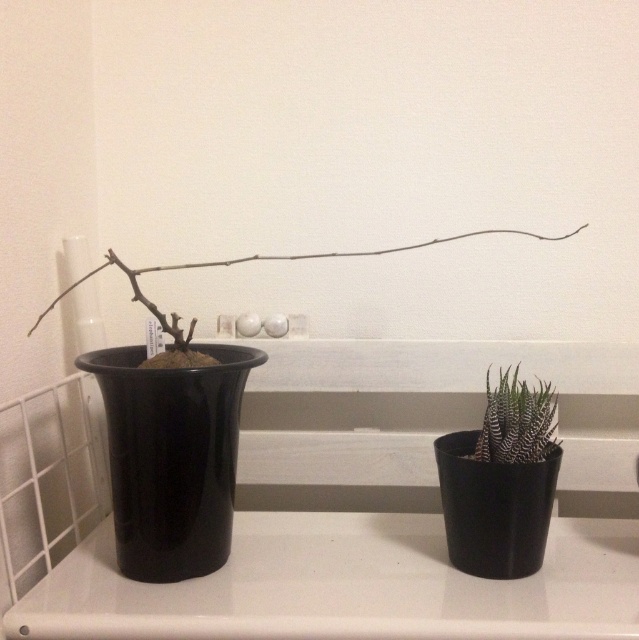
Does point (128, 412) come closer to viewer compared to point (127, 266)?

That is True.

Between point (206, 380) and point (413, 248), which one is positioned in front?

Positioned in front is point (206, 380).

The height and width of the screenshot is (640, 639). Describe the element at coordinates (171, 458) in the screenshot. I see `glossy black vase at left` at that location.

Find the location of `glossy black vase at left`. glossy black vase at left is located at coordinates (171, 458).

Does black glossy vase at lower right appear on the left side of textured black pot at right?

Yes, black glossy vase at lower right is to the left of textured black pot at right.

Can you confirm if black glossy vase at lower right is wider than textured black pot at right?

Yes.

Is point (466, 508) positioned in front of point (530, 458)?

Yes, it is.

Locate an element on the screen. This screenshot has width=639, height=640. black glossy vase at lower right is located at coordinates (493, 508).

Looking at this image, who is more forward, (498,413) or (458,234)?

Positioned in front is point (498,413).

Is textured black pot at right below brown matte branch at center?

Indeed, textured black pot at right is positioned under brown matte branch at center.

The height and width of the screenshot is (640, 639). What do you see at coordinates (516, 420) in the screenshot?
I see `textured black pot at right` at bounding box center [516, 420].

Find the location of a particular element. textured black pot at right is located at coordinates pos(516,420).